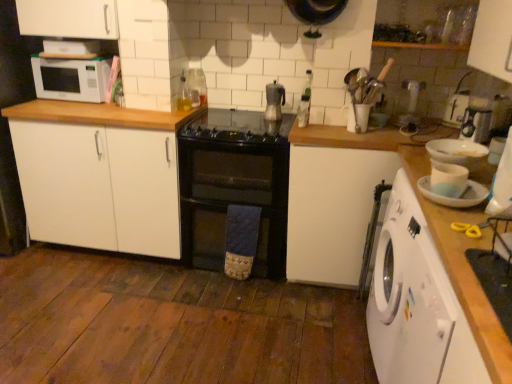
Identify the location of free space in front of black glass oven at center. The width and height of the screenshot is (512, 384). coord(228,305).